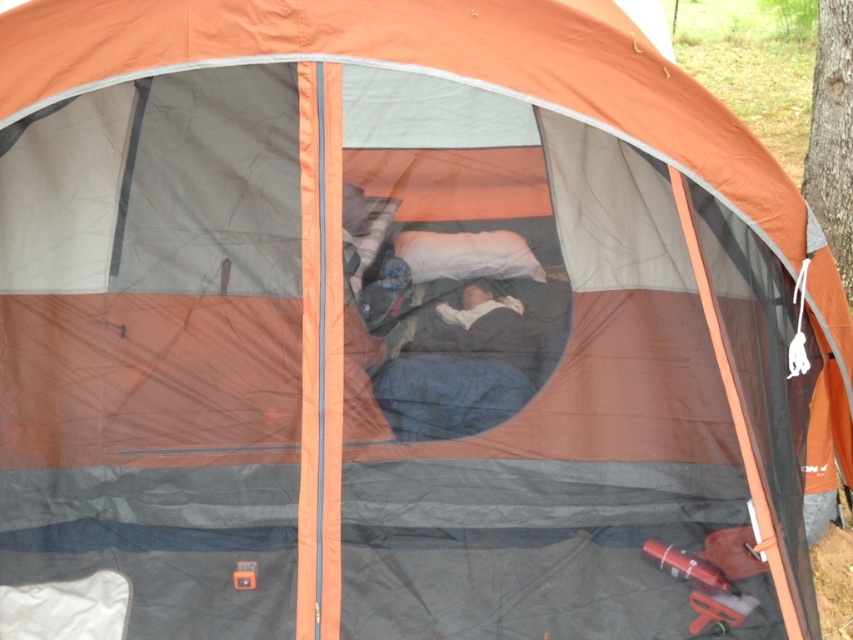
You are setting up a camping tent and want to place both the dark blue sleeping bag at center and the white soft pillow at center inside. Given their sizes, which item should you place first to ensure both fit comfortably?

The dark blue sleeping bag at center is wider than the white soft pillow at center, so you should place the dark blue sleeping bag at center first to accommodate its larger size before placing the white soft pillow at center.

You are setting up a camping tent and have a dark blue sleeping bag at center and a white soft pillow at center. You want to place them so that they are exactly 12 inches apart. Based on the current setup, should you move the pillow closer to or farther from the sleeping bag?

The current distance between the dark blue sleeping bag at center and the white soft pillow at center is 11.04 inches. To reach the desired 12 inches, you should move the pillow slightly farther away from the sleeping bag.